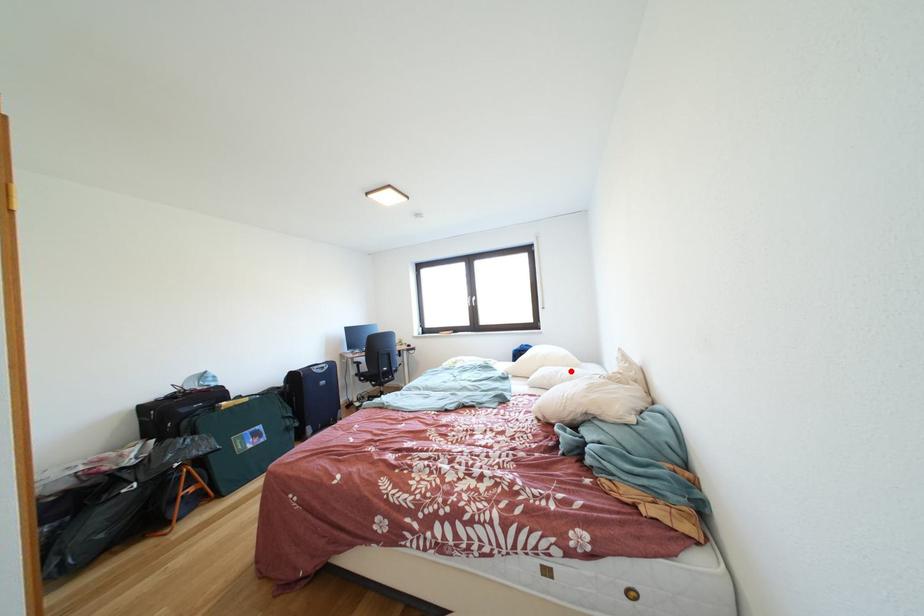
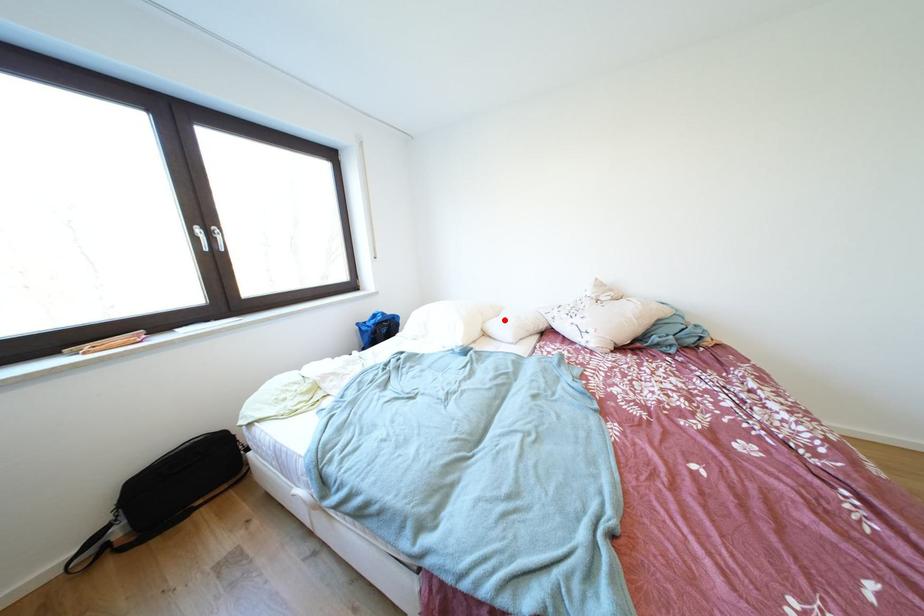
I am providing you with two images of the same scene from different viewpoints. A red point is marked on the first image and another point is marked on the second image. Do the highlighted points in image1 and image2 indicate the same real-world spot?

Yes